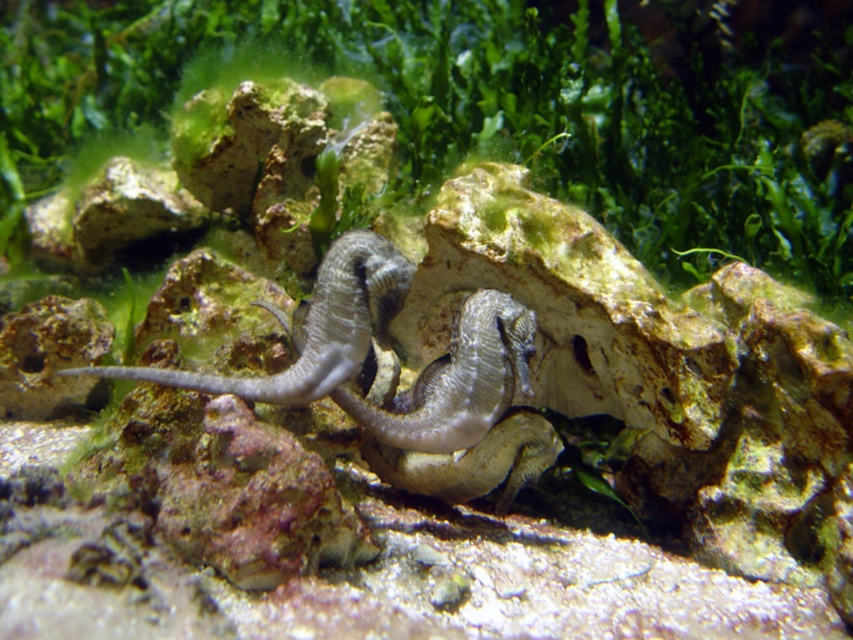
You are a marine biologist observing an underwater scene. You notice the green algae at center and the gray matte seahorse at center. Which object is taller in this environment?

The green algae at center is much taller than the gray matte seahorse at center.

You are a marine biologist observing underwater. You want to take a photo of the point at coordinate point (10, 33). Your camera has a maximum focus range of 10 feet. Will you be able to focus on the point?

The point at coordinate point (10, 33) is 9.40 feet away from the camera, which is within the camera maximum focus range of 10 feet. Yes, you can focus on the point.